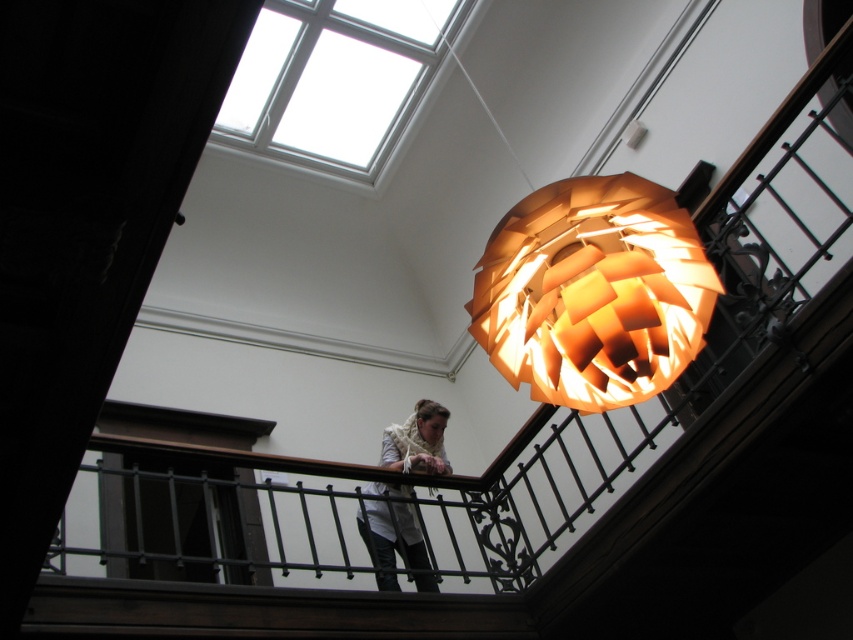
Question: Which point is closer to the camera?

Choices:
 (A) matte orange paper lampshade at upper center
 (B) white fabric at center

Answer: (A)

Question: Does matte orange paper lampshade at upper center come in front of white fabric at center?

Choices:
 (A) no
 (B) yes

Answer: (B)

Question: Which object is farther from the camera taking this photo?

Choices:
 (A) matte orange paper lampshade at upper center
 (B) white fabric at center

Answer: (B)

Question: Is matte orange paper lampshade at upper center thinner than white fabric at center?

Choices:
 (A) yes
 (B) no

Answer: (B)

Question: Is matte orange paper lampshade at upper center closer to the viewer compared to white fabric at center?

Choices:
 (A) no
 (B) yes

Answer: (B)